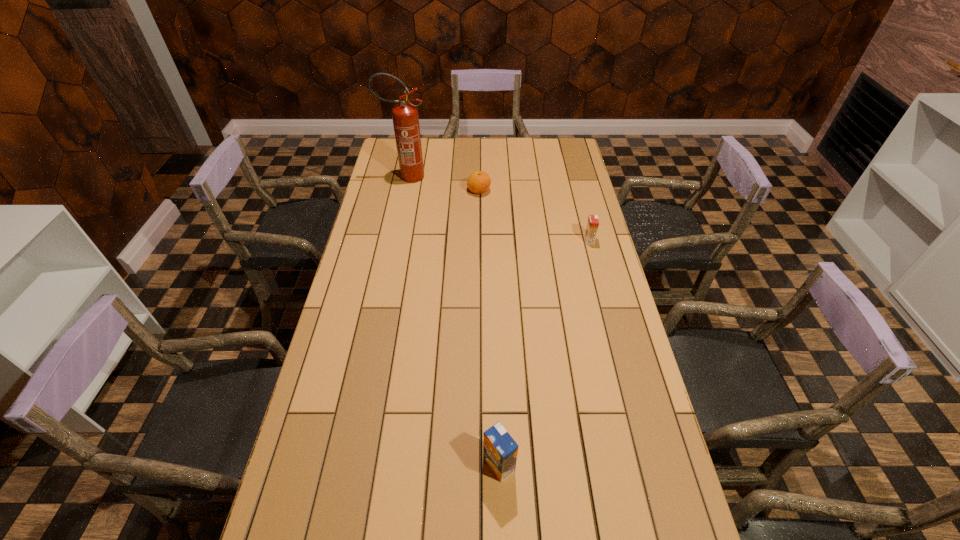
You are a GUI agent. You are given a task and a screenshot of the screen. Output one action in this format:
    pyautogui.click(x=<x>, y=<y>)
    Task: Click on the free spot that satisfies the following two spatial constraints: 1. on the back side of the left orange juice; 2. from the nozzle of the farthest object
    This screenshot has width=960, height=540.
    Given the screenshot: What is the action you would take?
    pyautogui.click(x=491, y=177)

Locate an element on the screen. The width and height of the screenshot is (960, 540). free space that satisfies the following two spatial constraints: 1. from the nozzle of the shortest object; 2. on the right side of the tallest object is located at coordinates (404, 190).

Where is `vacant region that satisfies the following two spatial constraints: 1. from the nozzle of the taller orange juice; 2. on the right side of the fire extinguisher`? The height and width of the screenshot is (540, 960). vacant region that satisfies the following two spatial constraints: 1. from the nozzle of the taller orange juice; 2. on the right side of the fire extinguisher is located at coordinates (348, 465).

Where is `vacant region that satisfies the following two spatial constraints: 1. from the nozzle of the third nearest object; 2. on the right side of the fire extinguisher`? This screenshot has width=960, height=540. vacant region that satisfies the following two spatial constraints: 1. from the nozzle of the third nearest object; 2. on the right side of the fire extinguisher is located at coordinates (404, 190).

The width and height of the screenshot is (960, 540). I want to click on vacant space that satisfies the following two spatial constraints: 1. on the back side of the clementine; 2. from the nozzle of the fire extinguisher, so click(x=479, y=177).

Where is `vacant space that satisfies the following two spatial constraints: 1. from the nozzle of the farther orange juice; 2. on the right side of the leftmost object`? The image size is (960, 540). vacant space that satisfies the following two spatial constraints: 1. from the nozzle of the farther orange juice; 2. on the right side of the leftmost object is located at coordinates (394, 240).

I want to click on free space that satisfies the following two spatial constraints: 1. from the nozzle of the tallest object; 2. on the back side of the taller orange juice, so click(348, 465).

Locate an element on the screen. The width and height of the screenshot is (960, 540). vacant region that satisfies the following two spatial constraints: 1. from the nozzle of the farthest object; 2. on the back side of the second nearest object is located at coordinates (394, 240).

What are the coordinates of `free space that satisfies the following two spatial constraints: 1. from the nozzle of the third nearest object; 2. on the right side of the leftmost object` in the screenshot? It's located at (404, 190).